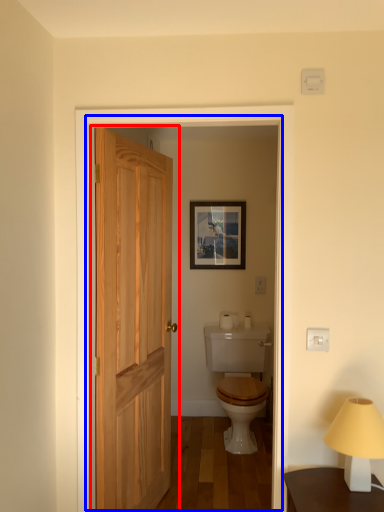
Question: Which of the following is the farthest to the observer, door (highlighted by a red box) or screen door (highlighted by a blue box)?

Choices:
 (A) door
 (B) screen door

Answer: (A)